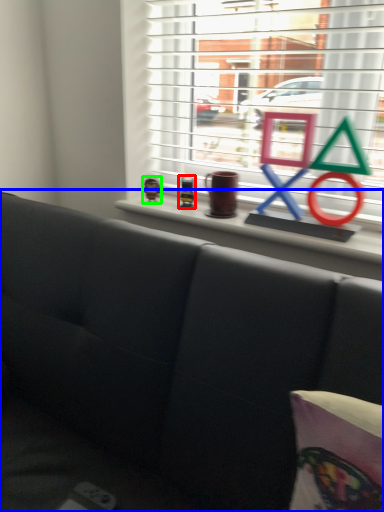
Question: Considering the real-world distances, which object is farthest from toy (highlighted by a red box)? studio couch (highlighted by a blue box) or toy (highlighted by a green box)?

Choices:
 (A) studio couch
 (B) toy

Answer: (A)